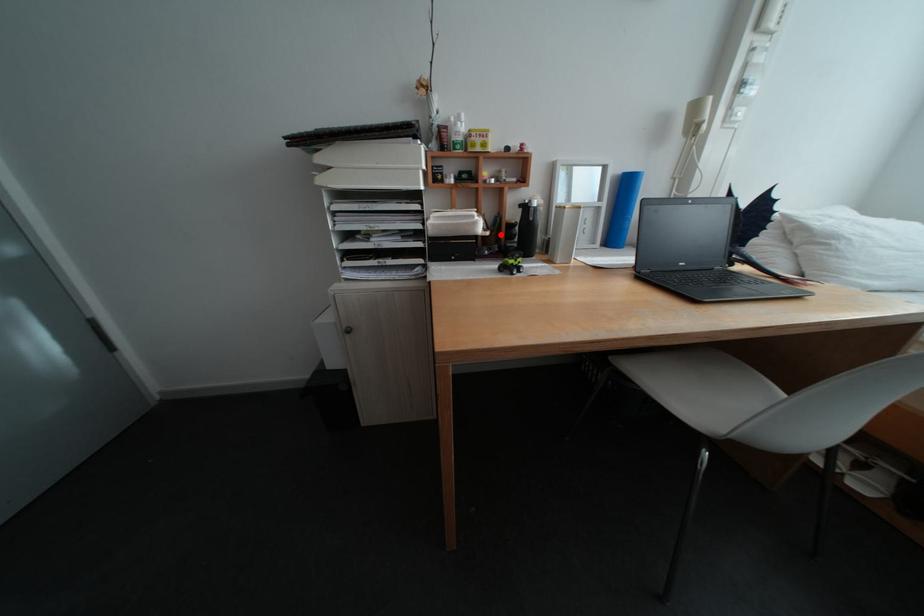
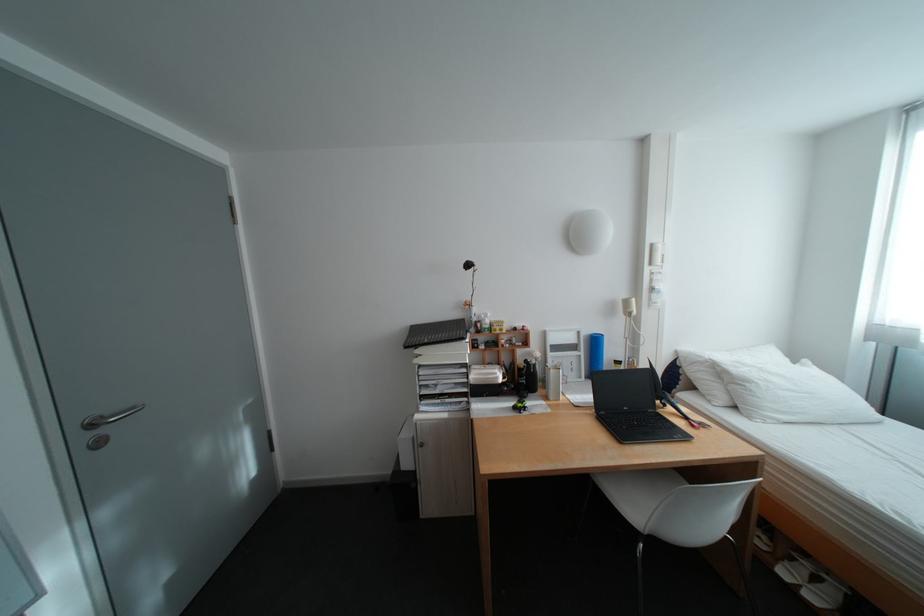
Question: I am providing you with two images of the same scene from different viewpoints. Given a red point in image1, look at the same physical point in image2. Is it:

Choices:
 (A) Closer to the viewpoint
 (B) Farther from the viewpoint

Answer: (B)